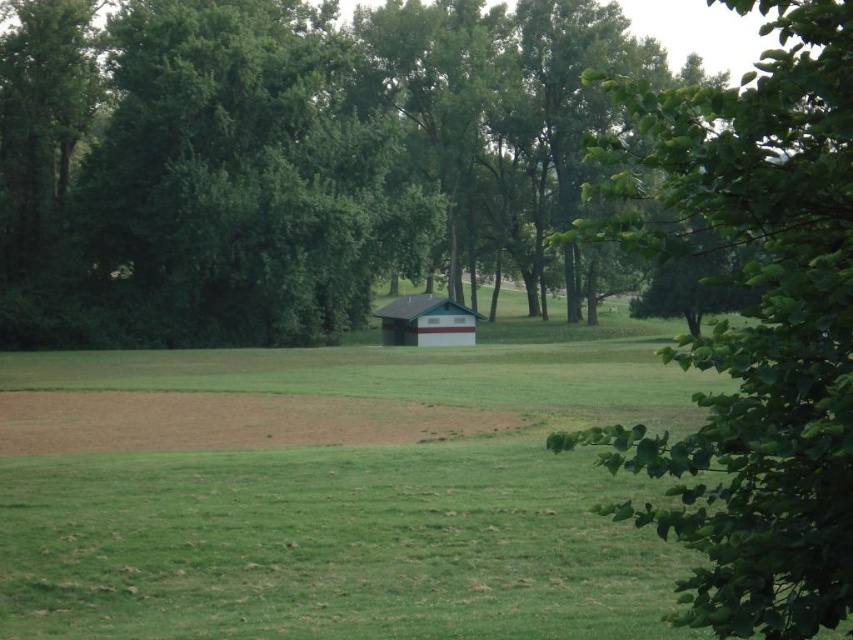
You are planning to plant a new tree in the park. You notice two existing green leafy trees in the scene. Which of the two green leafy trees at center and green leafy tree at center right has a wider spread of branches?

The green leafy tree at center has a wider spread of branches than the green leafy tree at center right, as its width surpasses the other.

You are standing at the center of the grassy field in the park. You want to walk towards the green leafy tree at center right. What direction should you face to walk straight towards it?

You should face towards the center right direction to walk straight towards the green leafy tree at center right, as it is positioned at point (747, 321) in the image.

You are a gardener planning to plant a new flower bed between the green leafy tree at center right and the green shingled barn at center. Based on their positions, which object is closer to the flower bed location?

The green leafy tree at center right is closer to the flower bed location because it is positioned over the green shingled barn at center, indicating it is nearer in the scene.